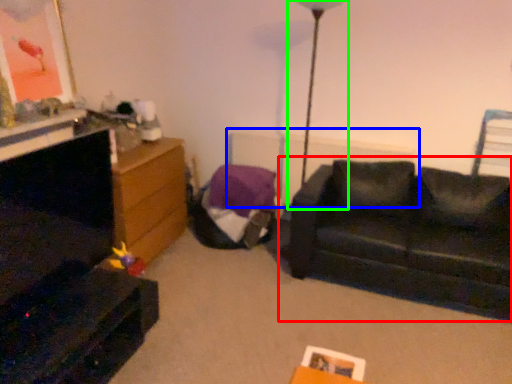
Question: Considering the real-world distances, which object is closest to studio couch (highlighted by a red box)? radiator (highlighted by a blue box) or table lamp (highlighted by a green box).

Choices:
 (A) radiator
 (B) table lamp

Answer: (A)